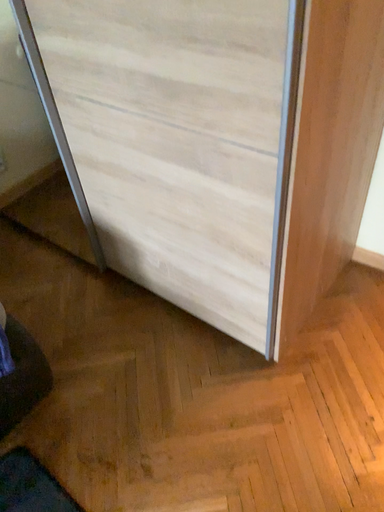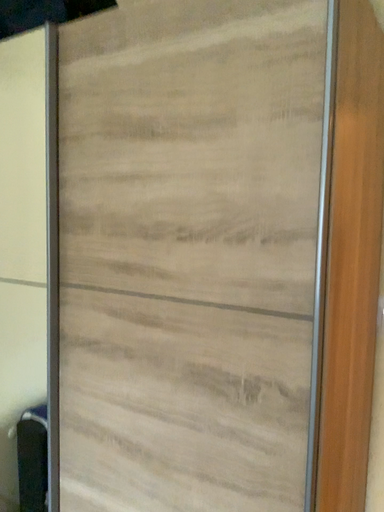
Question: How did the camera likely rotate when shooting the video?

Choices:
 (A) rotated left
 (B) rotated right

Answer: (B)